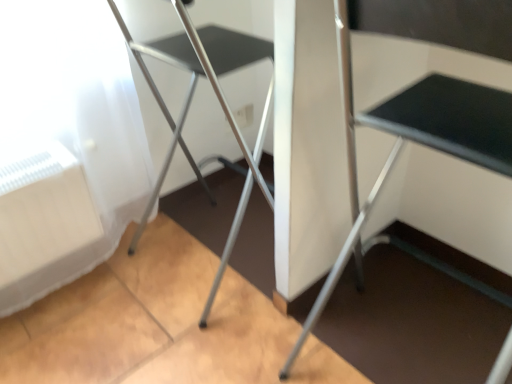
Question: Choose the correct answer: Is silver metallic folding table at center inside metallic silver chair at left or outside it?

Choices:
 (A) inside
 (B) outside

Answer: (B)

Question: Is silver metallic folding table at center bigger or smaller than metallic silver chair at left?

Choices:
 (A) small
 (B) big

Answer: (B)

Question: In terms of height, does silver metallic folding table at center look taller or shorter compared to metallic silver chair at left?

Choices:
 (A) tall
 (B) short

Answer: (A)

Question: Is metallic silver chair at left in front of or behind silver metallic folding table at center in the image?

Choices:
 (A) front
 (B) behind

Answer: (B)

Question: Which is correct: metallic silver chair at left is inside silver metallic folding table at center, or outside of it?

Choices:
 (A) inside
 (B) outside

Answer: (B)

Question: Is point (214, 200) positioned closer to the camera than point (394, 129)?

Choices:
 (A) farther
 (B) closer

Answer: (A)

Question: From the image's perspective, relative to silver metallic folding table at center, is metallic silver chair at left above or below?

Choices:
 (A) above
 (B) below

Answer: (A)